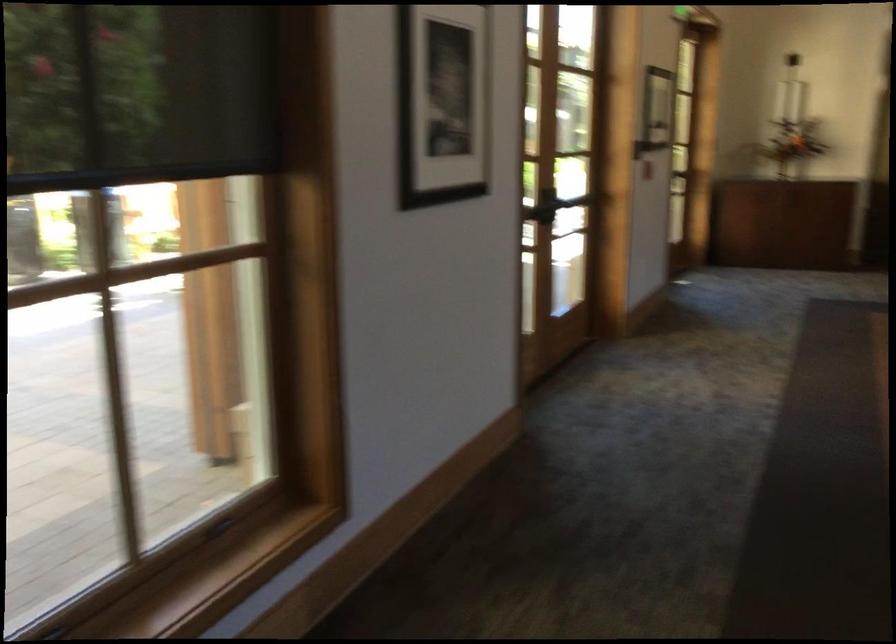
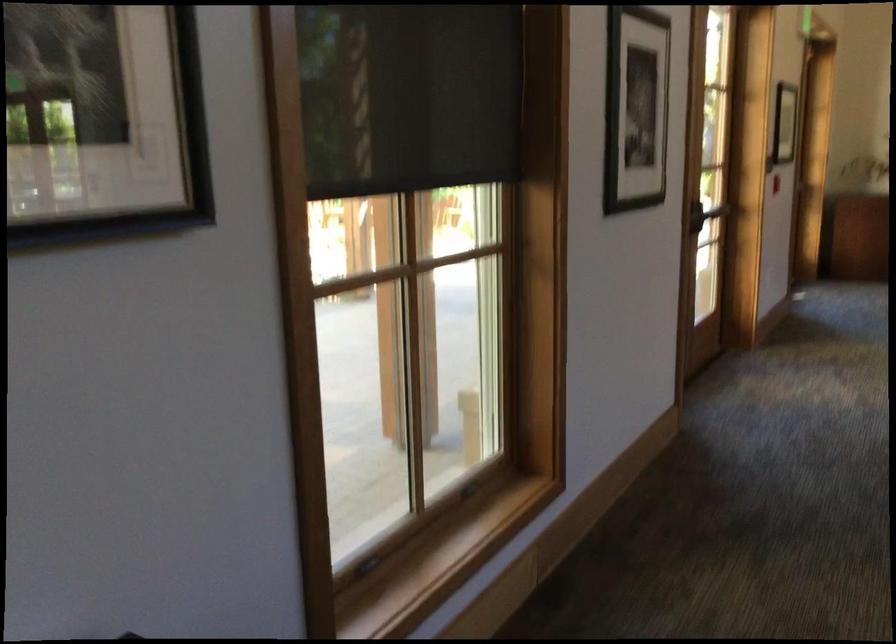
What movement of the cameraman would produce the second image?

The cameraman walked toward left, backward.